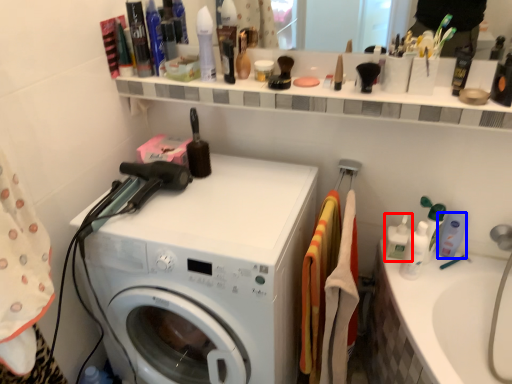
Question: Which point is further to the camera, cleaning product (highlighted by a red box) or cleaning product (highlighted by a blue box)?

Choices:
 (A) cleaning product
 (B) cleaning product

Answer: (B)